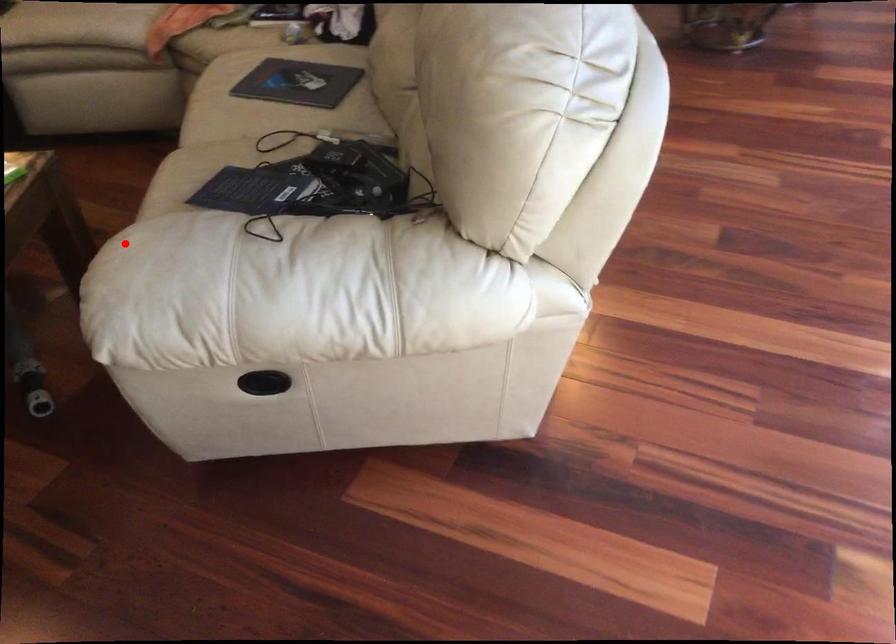
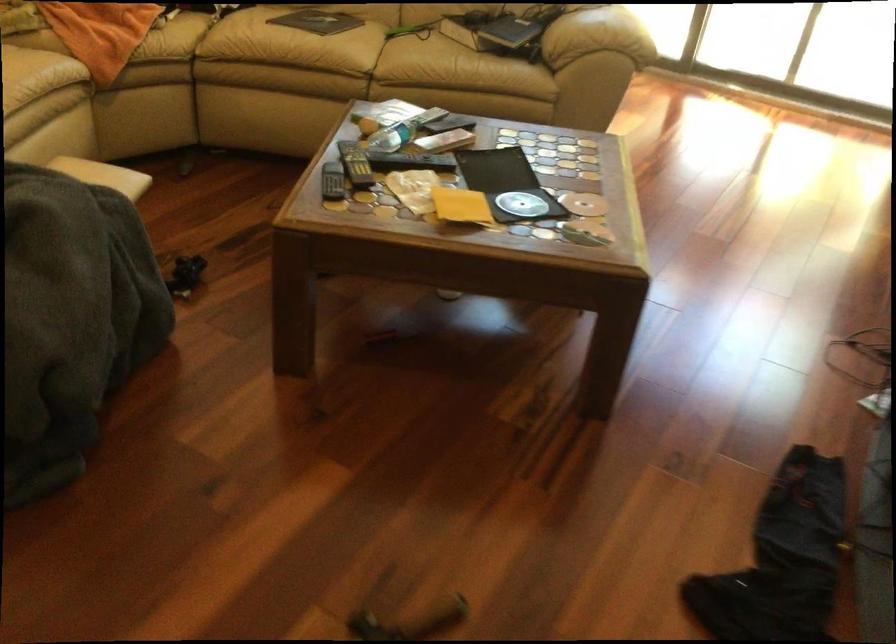
Question: A red point is marked in image1. In image2, is the corresponding 3D point closer to the camera or farther? Reply with the corresponding letter.

Choices:
 (A) The corresponding 3D point is closer.
 (B) The corresponding 3D point is farther.

Answer: (B)